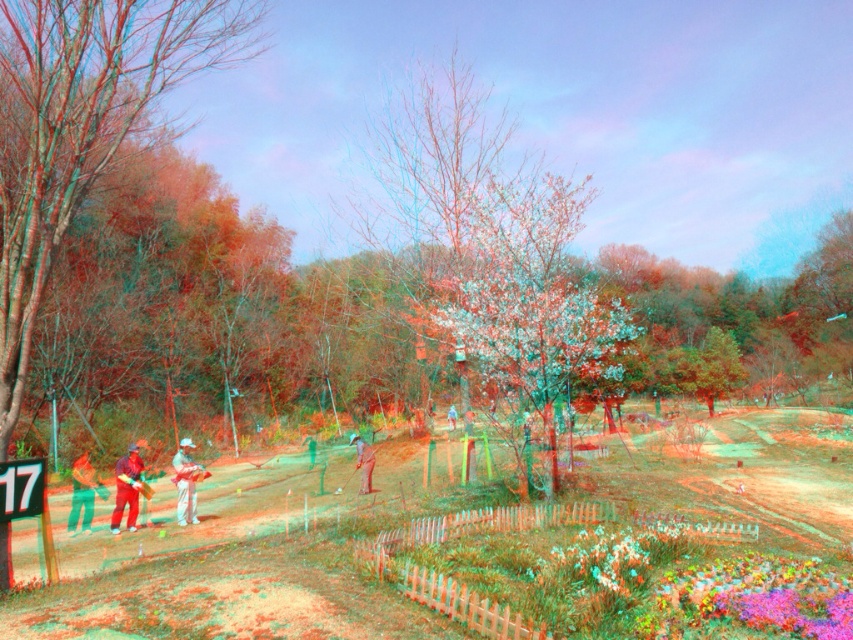
You are a photographer setting up for a photoshoot in the park. You have two shirts to choose from, the green fabric shirt at left and the matte gray shirt at center. Which shirt is placed on top of the other?

The green fabric shirt at left is positioned over the matte gray shirt at center.

You are standing at the entrance of the park and see the fluffy white blossoms at center. If you walk straight ahead, will you reach the blossoms before the fence?

The fluffy white blossoms at center are located at point (492, 253) in the image. Since the entrance is at the bottom of the image, walking straight ahead would lead you directly to the blossoms before encountering the fence, which is positioned further back in the scene.

You are organizing a charity event and need to display two shirts for a fashion show. The green fabric shirt at left and the matte gray shirt at center are placed on mannequins. Which shirt should be placed on the smaller mannequin?

The green fabric shirt at left has a smaller size compared to the matte gray shirt at center, so it should be placed on the smaller mannequin.